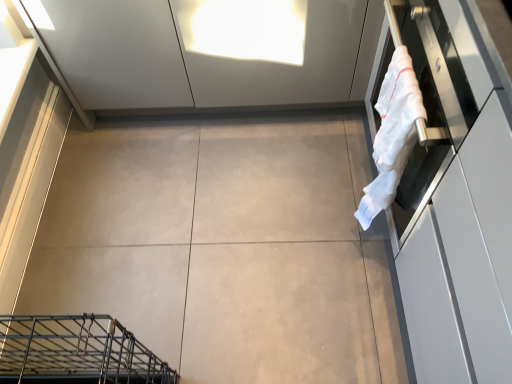
Question: In the image, is white cotton towel at right positioned in front of or behind white glossy oven at right?

Choices:
 (A) front
 (B) behind

Answer: (B)

Question: From a real-world perspective, relative to white glossy oven at right, is white cotton towel at right vertically above or below?

Choices:
 (A) below
 (B) above

Answer: (A)

Question: Which is farther from the white cotton towel at right?

Choices:
 (A) gray matte concrete at center
 (B) white glossy oven at right

Answer: (A)

Question: Estimate the real-world distances between objects in this image. Which object is farther from the white glossy oven at right?

Choices:
 (A) gray matte concrete at center
 (B) white cotton towel at right

Answer: (A)